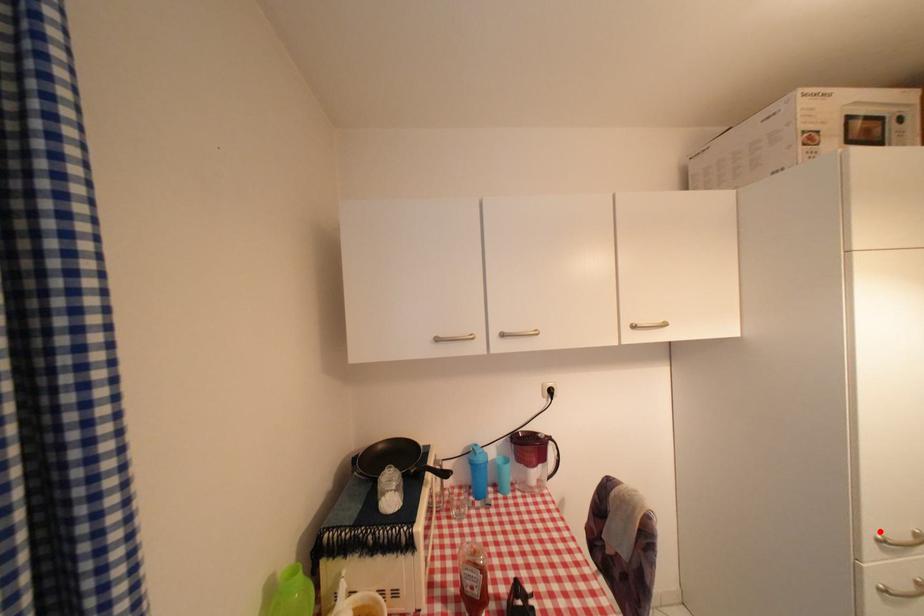
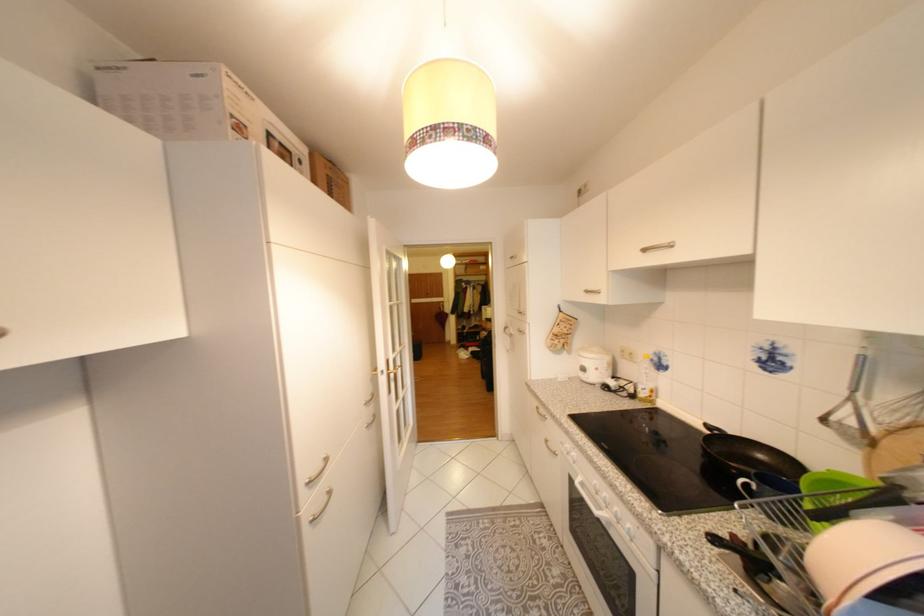
The point at the highlighted location is marked in the first image. Where is the corresponding point in the second image?

(311, 482)